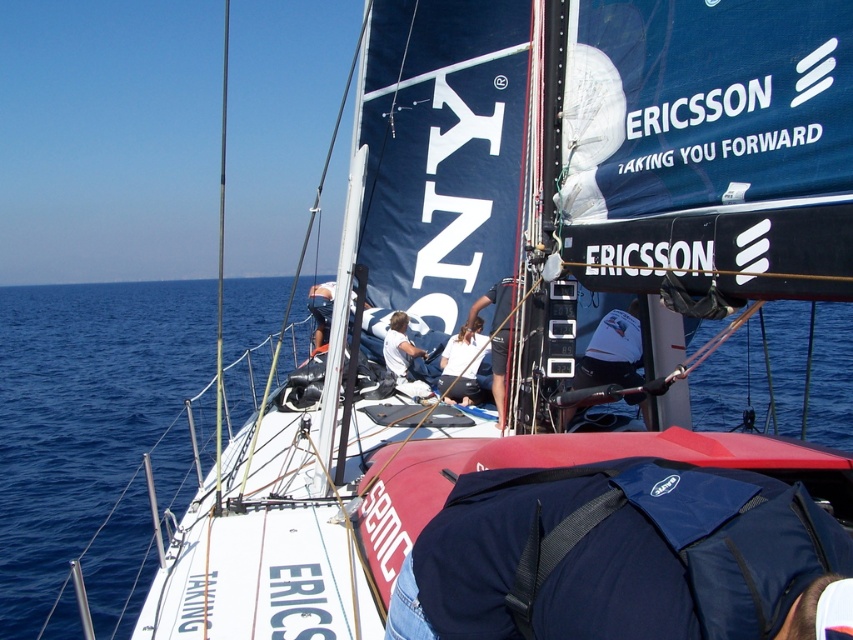
Based on the photo, can you confirm if blue fabric bag at center is taller than white fabric at center?

No.

Can you confirm if blue fabric bag at center is bigger than white fabric at center?

Yes, blue fabric bag at center is bigger than white fabric at center.

Which is behind, point (682, 538) or point (447, 380)?

Point (447, 380)

Image resolution: width=853 pixels, height=640 pixels. Find the location of `blue fabric bag at center`. blue fabric bag at center is located at coordinates (624, 557).

Can you confirm if white fabric at center is wider than white fabric shirt at center?

Yes, white fabric at center is wider than white fabric shirt at center.

Which is in front, point (456, 355) or point (408, 349)?

Point (456, 355)

In order to click on white fabric at center in this screenshot , I will do `click(462, 364)`.

Is point (746, 472) less distant than point (404, 323)?

Yes, it is in front of point (404, 323).

Is point (447, 608) more distant than point (393, 321)?

No, it is not.

At what (x,y) coordinates should I click in order to perform the action: click on blue fabric bag at center. Please return your answer as a coordinate pair (x, y). The height and width of the screenshot is (640, 853). Looking at the image, I should click on (624, 557).